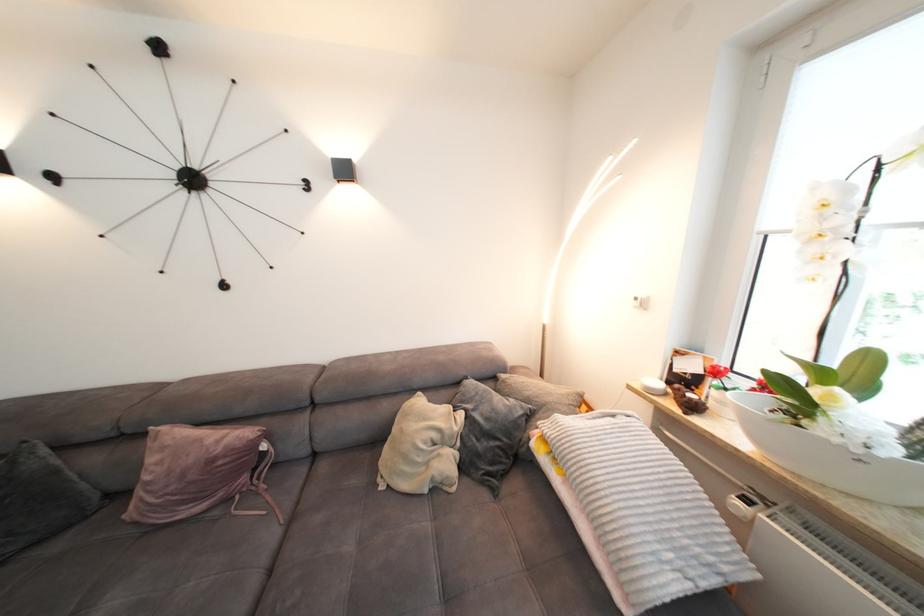
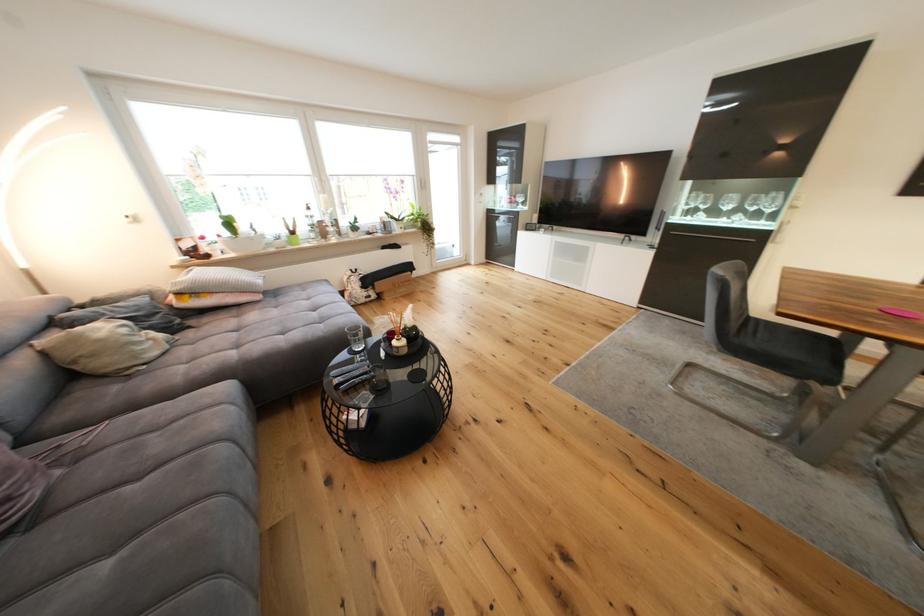
Find the pixel in the second image that matches [444,492] in the first image.

(178, 345)